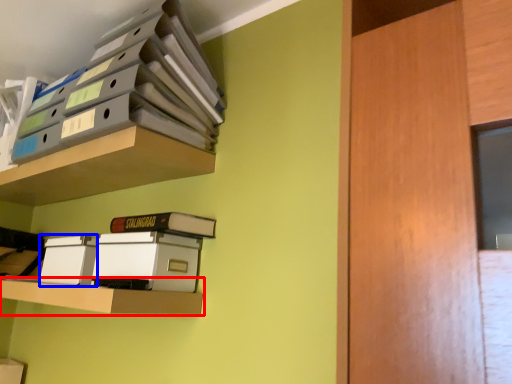
Question: Which point is closer to the camera, shelf (highlighted by a red box) or storage box (highlighted by a blue box)?

Choices:
 (A) shelf
 (B) storage box

Answer: (A)